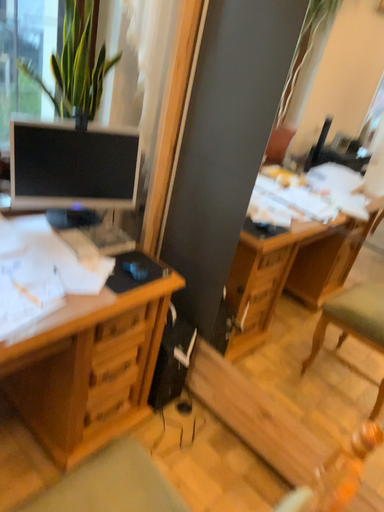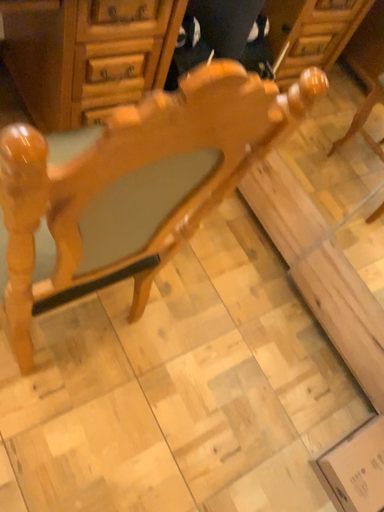
Question: Which way did the camera rotate in the video?

Choices:
 (A) rotated right
 (B) rotated left

Answer: (B)